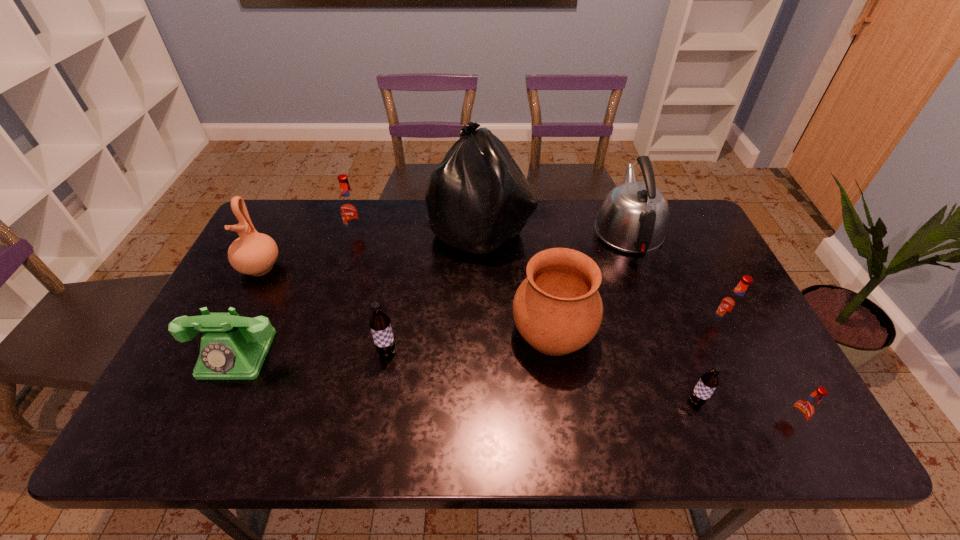
At what (x,y) coordinates should I click in order to perform the action: click on free space located on the left of the second root beer from right to left. Please return your answer as a coordinate pair (x, y). Looking at the image, I should click on (647, 326).

Identify the location of vacant position located 0.130m on the dial of the telephone. This screenshot has height=540, width=960. (201, 433).

Where is `free space located 0.390m on the back of the nearest root beer`? This screenshot has height=540, width=960. free space located 0.390m on the back of the nearest root beer is located at coordinates (720, 289).

What are the coordinates of `free region located 0.290m on the left of the right brown root beer` in the screenshot? It's located at (563, 401).

The height and width of the screenshot is (540, 960). I want to click on plastic bag that is positioned at the far edge, so click(477, 198).

I want to click on kettle positioned at the far edge, so [633, 218].

Identify the location of root beer that is at the far edge. This screenshot has width=960, height=540. (350, 209).

Locate an element on the screen. Image resolution: width=960 pixels, height=540 pixels. object present at the near edge is located at coordinates (804, 408).

Locate an element on the screen. The image size is (960, 540). pottery that is at the left edge is located at coordinates (253, 253).

Locate an element on the screen. This screenshot has width=960, height=540. telephone at the left edge is located at coordinates (233, 347).